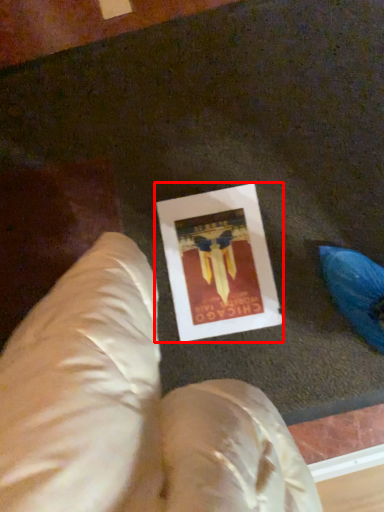
Question: Where is picture frame (annotated by the red box) located in relation to bean bag chair in the image?

Choices:
 (A) right
 (B) left

Answer: (A)